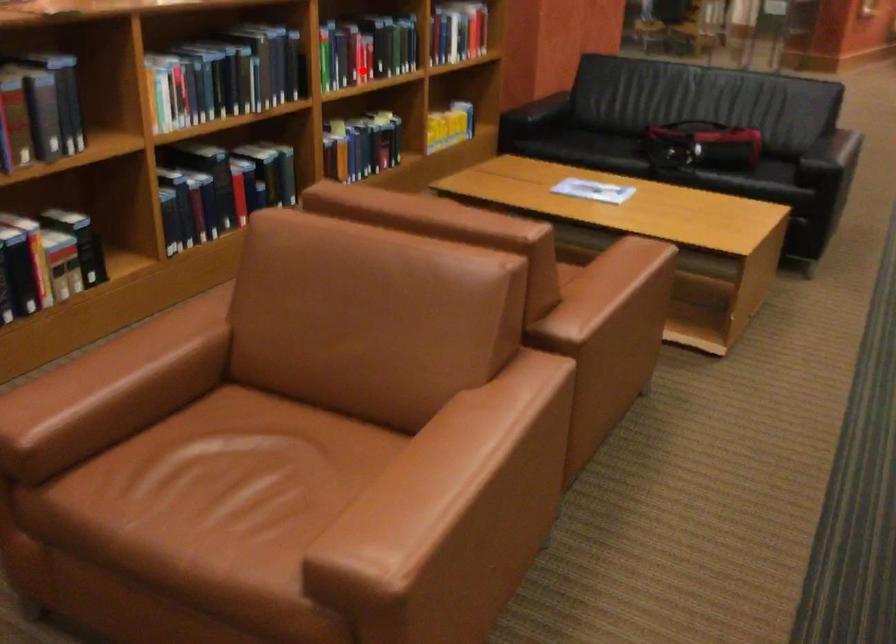
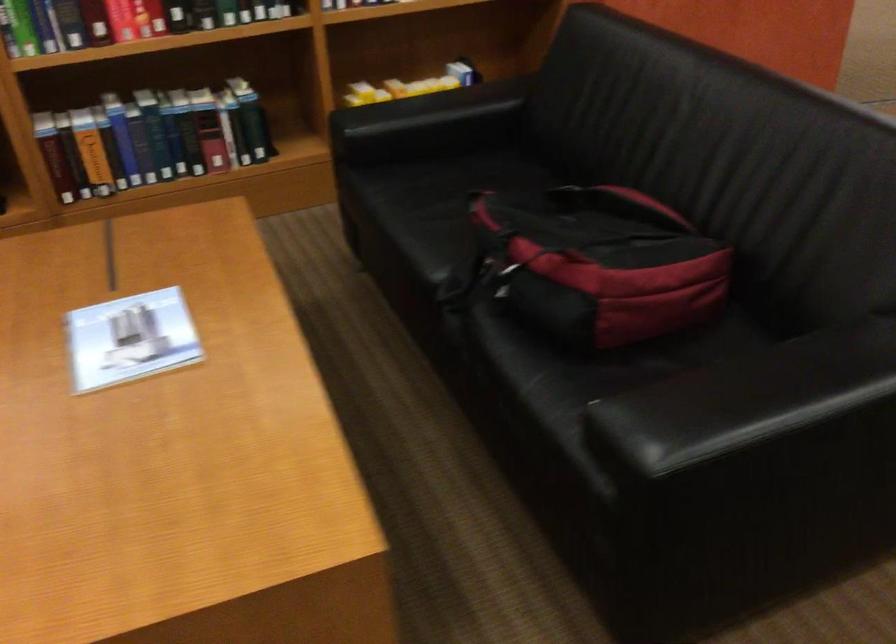
Question: I am providing you with two images of the same scene from different viewpoints. A red point is shown in image1. For the corresponding object point in image2, is it positioned nearer or farther from the camera?

Choices:
 (A) Nearer
 (B) Farther

Answer: (A)